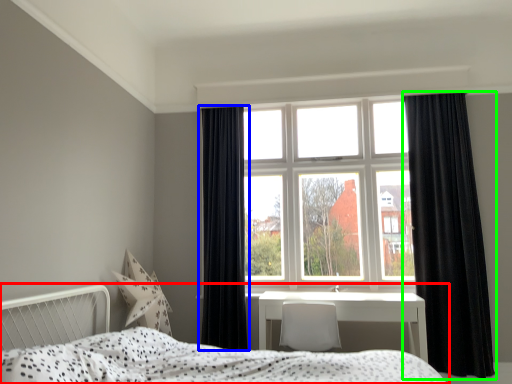
Question: Based on their relative distances, which object is nearer to bed (highlighted by a red box)? Choose from curtain (highlighted by a blue box) and curtain (highlighted by a green box).

Choices:
 (A) curtain
 (B) curtain

Answer: (A)